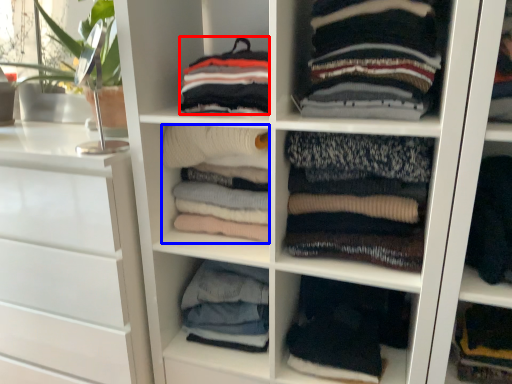
Question: Which point is closer to the camera, clothing (highlighted by a red box) or clothing (highlighted by a blue box)?

Choices:
 (A) clothing
 (B) clothing

Answer: (A)